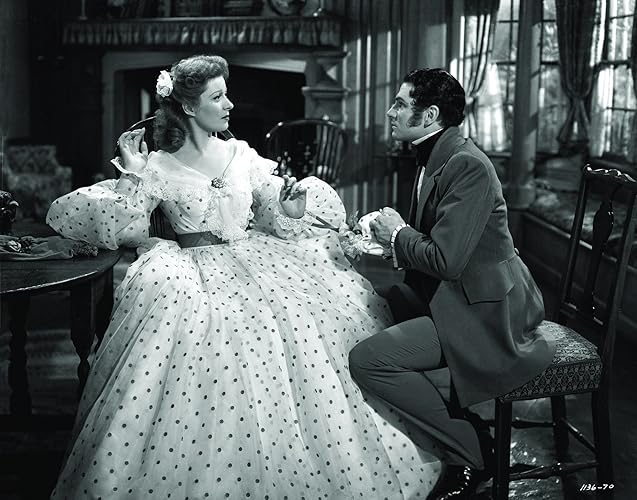
Find the location of a particular element. Image resolution: width=637 pixels, height=500 pixels. floor is located at coordinates (62, 406).